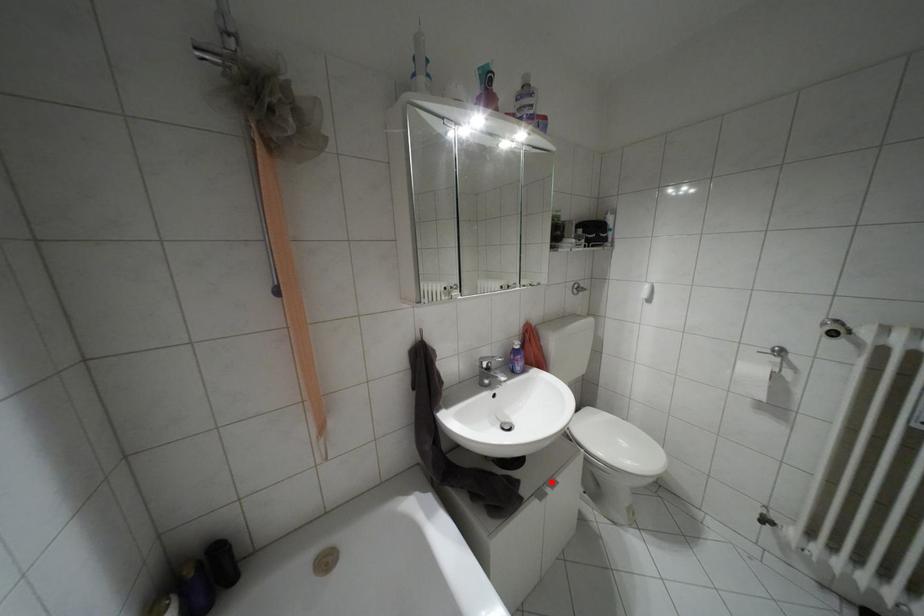
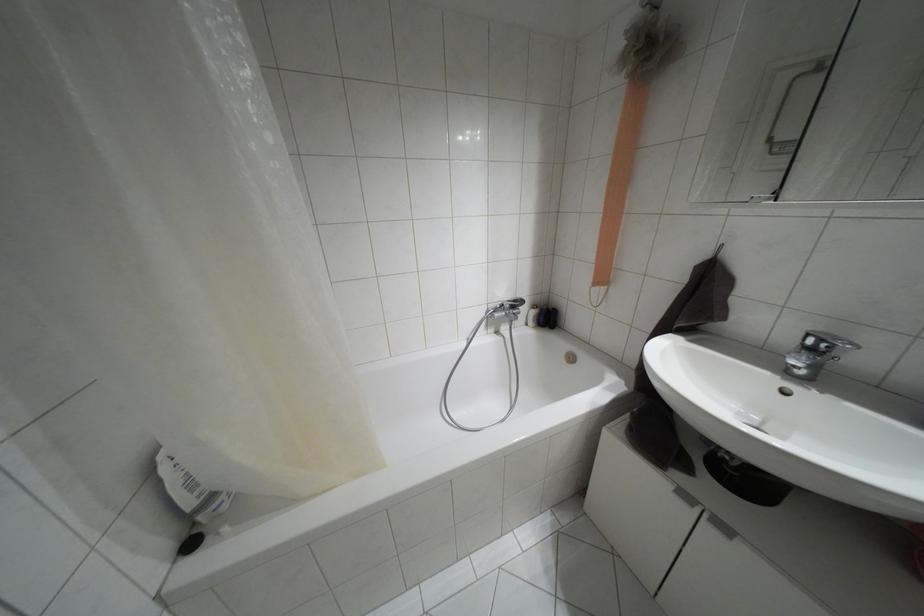
Where in the second image is the point corresponding to the highlighted location from the first image?

(723, 528)